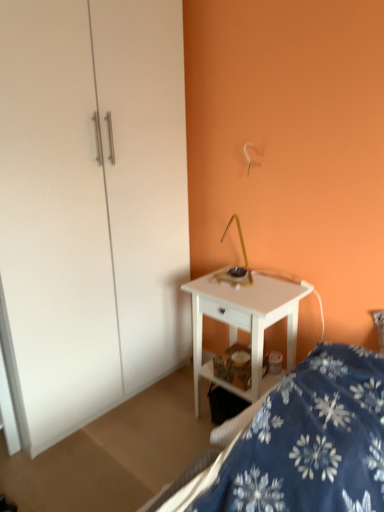
This screenshot has width=384, height=512. I want to click on white glossy desk at center, so click(x=244, y=321).

Considering the points (325, 362) and (93, 70), which point is behind, point (325, 362) or point (93, 70)?

The point (93, 70) is farther from the camera.

Who is taller, blue floral fabric bed at lower right or white glossy dresser at center?

white glossy dresser at center is taller.

From a real-world perspective, is blue floral fabric bed at lower right positioned under white glossy dresser at center based on gravity?

Yes, from a real-world perspective, blue floral fabric bed at lower right is under white glossy dresser at center.

Is blue floral fabric bed at lower right to the left of white glossy dresser at center from the viewer's perspective?

No.

In terms of height, does white glossy dresser at center look taller or shorter compared to blue floral fabric bed at lower right?

white glossy dresser at center is taller than blue floral fabric bed at lower right.

From the image's perspective, which object appears higher, white glossy dresser at center or blue floral fabric bed at lower right?

white glossy dresser at center is shown above in the image.

Considering the positions of points (32, 339) and (233, 469), is point (32, 339) closer to camera compared to point (233, 469)?

No, (32, 339) is behind (233, 469).

Is white glossy desk at center at the back of blue floral fabric bed at lower right?

That's not correct — blue floral fabric bed at lower right is not looking away from white glossy desk at center.

Does blue floral fabric bed at lower right appear on the right side of white glossy desk at center?

Yes.

Which of these two, blue floral fabric bed at lower right or white glossy desk at center, is thinner?

white glossy desk at center is thinner.

Locate an element on the screen. desk behind the blue floral fabric bed at lower right is located at coordinates (244, 321).

Would you consider white glossy desk at center to be distant from blue floral fabric bed at lower right?

white glossy desk at center is actually quite close to blue floral fabric bed at lower right.

Between white glossy desk at center and blue floral fabric bed at lower right, which one has larger width?

blue floral fabric bed at lower right.

Can you confirm if white glossy desk at center is taller than blue floral fabric bed at lower right?

Yes.

Considering the sizes of objects white glossy desk at center and white glossy dresser at center in the image provided, who is thinner, white glossy desk at center or white glossy dresser at center?

Thinner between the two is white glossy desk at center.

Is white glossy desk at center outside of white glossy dresser at center?

Yes.

Find the location of `desk lying behind the white glossy dresser at center`. desk lying behind the white glossy dresser at center is located at coordinates (244, 321).

Is white glossy dresser at center in front of or behind white glossy desk at center in the image?

Visually, white glossy dresser at center is located in front of white glossy desk at center.

How many degrees apart are the facing directions of white glossy dresser at center and white glossy desk at center?

The facing directions of white glossy dresser at center and white glossy desk at center are 91.6 degrees apart.

Is point (12, 281) closer or farther from the camera than point (291, 297)?

Point (12, 281) appears to be closer to the viewer than point (291, 297).

How much distance is there between white glossy dresser at center and white glossy desk at center?

A distance of 60.68 centimeters exists between white glossy dresser at center and white glossy desk at center.

Where is `bed that appears on the right of white glossy dresser at center`? This screenshot has width=384, height=512. bed that appears on the right of white glossy dresser at center is located at coordinates (300, 444).

Locate an element on the screen. The height and width of the screenshot is (512, 384). dresser above the blue floral fabric bed at lower right (from a real-world perspective) is located at coordinates (91, 207).

Considering their positions, is white glossy dresser at center positioned closer to blue floral fabric bed at lower right than white glossy desk at center?

white glossy desk at center is closer to blue floral fabric bed at lower right.

From the image, which object appears to be nearer to white glossy dresser at center, white glossy desk at center or blue floral fabric bed at lower right?

The object closer to white glossy dresser at center is white glossy desk at center.

Considering their positions, is white glossy desk at center positioned closer to blue floral fabric bed at lower right than white glossy dresser at center?

Based on the image, white glossy desk at center appears to be nearer to blue floral fabric bed at lower right.

Consider the image. Considering their positions, is blue floral fabric bed at lower right positioned closer to white glossy dresser at center than white glossy desk at center?

The object closer to white glossy dresser at center is white glossy desk at center.

Estimate the real-world distances between objects in this image. Which object is further from white glossy desk at center, blue floral fabric bed at lower right or white glossy dresser at center?

white glossy dresser at center is further to white glossy desk at center.

Consider the image. When comparing their distances from white glossy desk at center, does white glossy dresser at center or blue floral fabric bed at lower right seem further?

Based on the image, white glossy dresser at center appears to be further to white glossy desk at center.

Where is `desk situated between white glossy dresser at center and blue floral fabric bed at lower right from left to right`? desk situated between white glossy dresser at center and blue floral fabric bed at lower right from left to right is located at coordinates (244, 321).